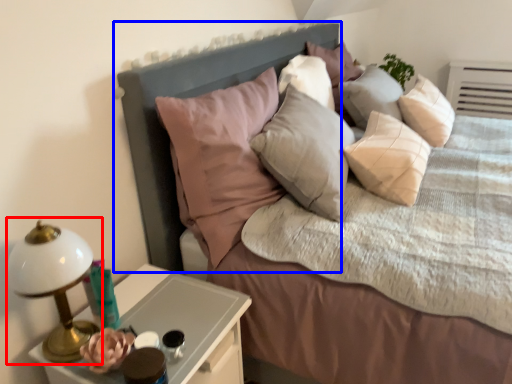
Question: Which of the following is the closest to the observer, bedside lamp (highlighted by a red box) or headboard (highlighted by a blue box)?

Choices:
 (A) bedside lamp
 (B) headboard

Answer: (A)